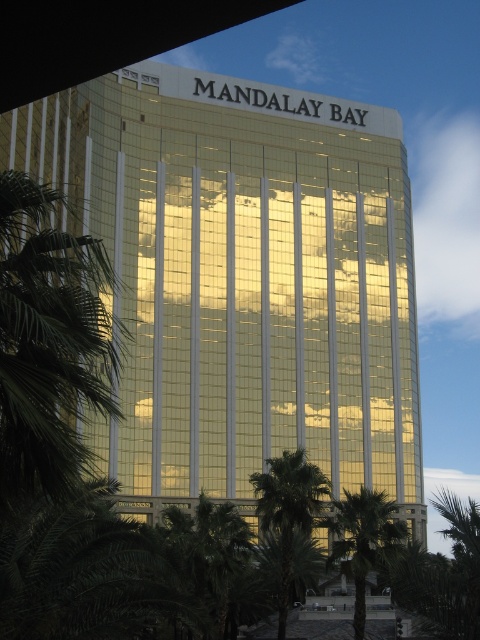
Based on the photo, based on the scene description, where is the green leafy palm tree at lower center located in the image?

The green leafy palm tree at lower center is located at the 2D coordinates point (362, 540).